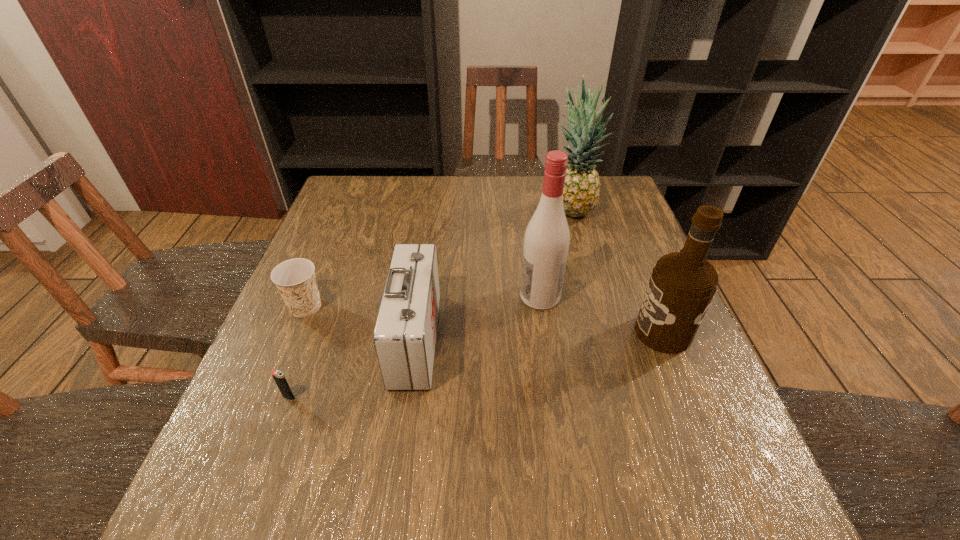
Where is `the farthest object`? the farthest object is located at coordinates (582, 184).

I want to click on the fourth object from left to right, so click(547, 237).

The height and width of the screenshot is (540, 960). Identify the location of the left alcohol. (547, 237).

This screenshot has width=960, height=540. In order to click on the right alcohol in this screenshot , I will do `click(682, 285)`.

Locate an element on the screen. Image resolution: width=960 pixels, height=540 pixels. the fourth shortest object is located at coordinates (682, 285).

You are a GUI agent. You are given a task and a screenshot of the screen. Output one action in this format:
    pyautogui.click(x=<x>, y=<y>)
    Task: Click on the fourth tallest object
    The width and height of the screenshot is (960, 540).
    Given the screenshot: What is the action you would take?
    pyautogui.click(x=404, y=337)

Find the location of `the first-aid kit`. the first-aid kit is located at coordinates (404, 337).

In order to click on Dixie cup in this screenshot , I will do `click(295, 279)`.

Find the location of a particular element. The height and width of the screenshot is (540, 960). igniter is located at coordinates (278, 376).

What are the coordinates of `the shortest object` in the screenshot? It's located at (278, 376).